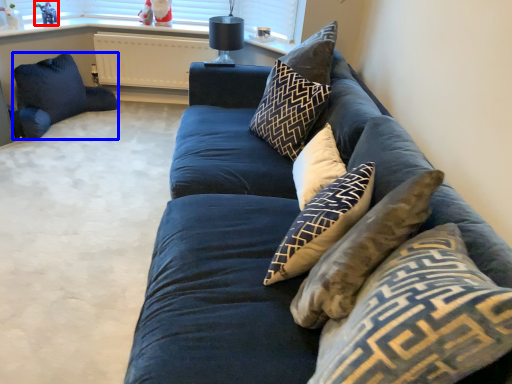
Question: Which object appears closest to the camera in this image, toy (highlighted by a red box) or pillow (highlighted by a blue box)?

Choices:
 (A) toy
 (B) pillow

Answer: (B)